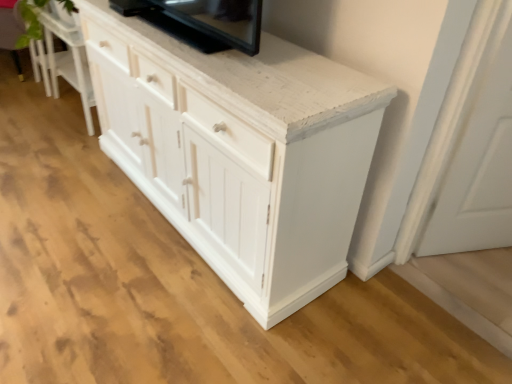
Where is `white wood cabinet at lower left`? This screenshot has width=512, height=384. white wood cabinet at lower left is located at coordinates (63, 57).

The width and height of the screenshot is (512, 384). What do you see at coordinates (473, 143) in the screenshot? I see `white matte door at lower right` at bounding box center [473, 143].

Where is `black glossy tv at upper center`? Image resolution: width=512 pixels, height=384 pixels. black glossy tv at upper center is located at coordinates (202, 21).

From the image's perspective, is white wood cabinet at lower left located beneath white painted wood cabinet at center?

No, from the image's perspective, white wood cabinet at lower left is not below white painted wood cabinet at center.

Is white wood cabinet at lower left bigger than white painted wood cabinet at center?

No.

Looking at this image, is white wood cabinet at lower left thinner than white painted wood cabinet at center?

Yes.

Would you say white wood cabinet at lower left is a long distance from white painted wood cabinet at center?

white wood cabinet at lower left is positioned a significant distance from white painted wood cabinet at center.

From a real-world perspective, which object rests below the other?

white matte door at lower right.

Is point (225, 44) closer or farther from the camera than point (503, 143)?

Point (225, 44) is closer to the camera than point (503, 143).

Would you say black glossy tv at upper center contains white matte door at lower right?

No, white matte door at lower right is not a part of black glossy tv at upper center.

Does black glossy tv at upper center come behind white matte door at lower right?

No, it is in front of white matte door at lower right.

Find the location of a particular element. Image resolution: width=512 pixels, height=384 pixels. vanity to the left of black glossy tv at upper center is located at coordinates (63, 57).

Is black glossy tv at upper center located outside white wood cabinet at lower left?

Indeed, black glossy tv at upper center is completely outside white wood cabinet at lower left.

Measure the distance between black glossy tv at upper center and white wood cabinet at lower left.

A distance of 1.15 meters exists between black glossy tv at upper center and white wood cabinet at lower left.

Is point (204, 7) closer or farther from the camera than point (48, 10)?

Point (204, 7) appears to be closer to the viewer than point (48, 10).

Considering the relative sizes of black glossy tv at upper center and green leafy plant at upper left in the image provided, is black glossy tv at upper center bigger than green leafy plant at upper left?

Incorrect, black glossy tv at upper center is not larger than green leafy plant at upper left.

Identify the location of appliance in front of the green leafy plant at upper left. The height and width of the screenshot is (384, 512). (202, 21).

From a real-world perspective, is black glossy tv at upper center positioned under green leafy plant at upper left based on gravity?

No.

Can you tell me how much black glossy tv at upper center and green leafy plant at upper left differ in facing direction?

black glossy tv at upper center and green leafy plant at upper left are facing 0.282 degrees away from each other.

In the scene shown: From a real-world perspective, which object stands above the other?

From a 3D spatial view, white wood cabinet at lower left is above.

Can you tell me how much white painted wood cabinet at center and white wood cabinet at lower left differ in facing direction?

The angle between the facing direction of white painted wood cabinet at center and the facing direction of white wood cabinet at lower left is 178 degrees.

Image resolution: width=512 pixels, height=384 pixels. What are the coordinates of `chest of drawers on the right of white wood cabinet at lower left` in the screenshot? It's located at (240, 151).

Is green leafy plant at upper left oriented away from white matte door at lower right?

No, green leafy plant at upper left is not facing away from white matte door at lower right.

Does green leafy plant at upper left have a greater width compared to white matte door at lower right?

Indeed, green leafy plant at upper left has a greater width compared to white matte door at lower right.

From a real-world perspective, between green leafy plant at upper left and white matte door at lower right, who is vertically higher?

green leafy plant at upper left.

In the image, is green leafy plant at upper left on the left side or the right side of white matte door at lower right?

green leafy plant at upper left is positioned on white matte door at lower right's left side.

Is white painted wood cabinet at center bigger or smaller than black glossy tv at upper center?

white painted wood cabinet at center is bigger than black glossy tv at upper center.

Is white painted wood cabinet at center positioned far away from black glossy tv at upper center?

No, there isn't a large distance between white painted wood cabinet at center and black glossy tv at upper center.

Considering the sizes of objects white painted wood cabinet at center and black glossy tv at upper center in the image provided, who is wider, white painted wood cabinet at center or black glossy tv at upper center?

With larger width is white painted wood cabinet at center.

From the image's perspective, is white painted wood cabinet at center above or below black glossy tv at upper center?

Clearly, from the image's perspective, white painted wood cabinet at center is below black glossy tv at upper center.

I want to click on vanity positioned vertically above the white painted wood cabinet at center (from a real-world perspective), so click(63, 57).

Where is `appliance on the left of white matte door at lower right`? appliance on the left of white matte door at lower right is located at coordinates (202, 21).

When comparing their distances from white matte door at lower right, does black glossy tv at upper center or white wood cabinet at lower left seem closer?

black glossy tv at upper center.

Estimate the real-world distances between objects in this image. Which object is further from green leafy plant at upper left, black glossy tv at upper center or white wood cabinet at lower left?

Among the two, black glossy tv at upper center is located further to green leafy plant at upper left.

Based on their spatial positions, is black glossy tv at upper center or green leafy plant at upper left closer to white wood cabinet at lower left?

green leafy plant at upper left lies closer to white wood cabinet at lower left than the other object.

Which object lies further to the anchor point white wood cabinet at lower left, white matte door at lower right or black glossy tv at upper center?

white matte door at lower right.

When comparing their distances from white matte door at lower right, does black glossy tv at upper center or white painted wood cabinet at center seem further?

black glossy tv at upper center.

From the image, which object appears to be nearer to white wood cabinet at lower left, white painted wood cabinet at center or black glossy tv at upper center?

black glossy tv at upper center is positioned closer to the anchor white wood cabinet at lower left.

Looking at the image, which one is located closer to white wood cabinet at lower left, black glossy tv at upper center or white matte door at lower right?

Based on the image, black glossy tv at upper center appears to be nearer to white wood cabinet at lower left.

From the image, which object appears to be nearer to black glossy tv at upper center, white matte door at lower right or green leafy plant at upper left?

white matte door at lower right is closer to black glossy tv at upper center.

What are the coordinates of `plant between white wood cabinet at lower left and white matte door at lower right` in the screenshot? It's located at [x=30, y=21].

I want to click on plant between black glossy tv at upper center and white wood cabinet at lower left in the front-back direction, so click(30, 21).

Find the location of a particular element. chest of drawers between white wood cabinet at lower left and white matte door at lower right from left to right is located at coordinates (240, 151).

Locate an element on the screen. This screenshot has height=384, width=512. the chest of drawers located between green leafy plant at upper left and white matte door at lower right in the left-right direction is located at coordinates (240, 151).